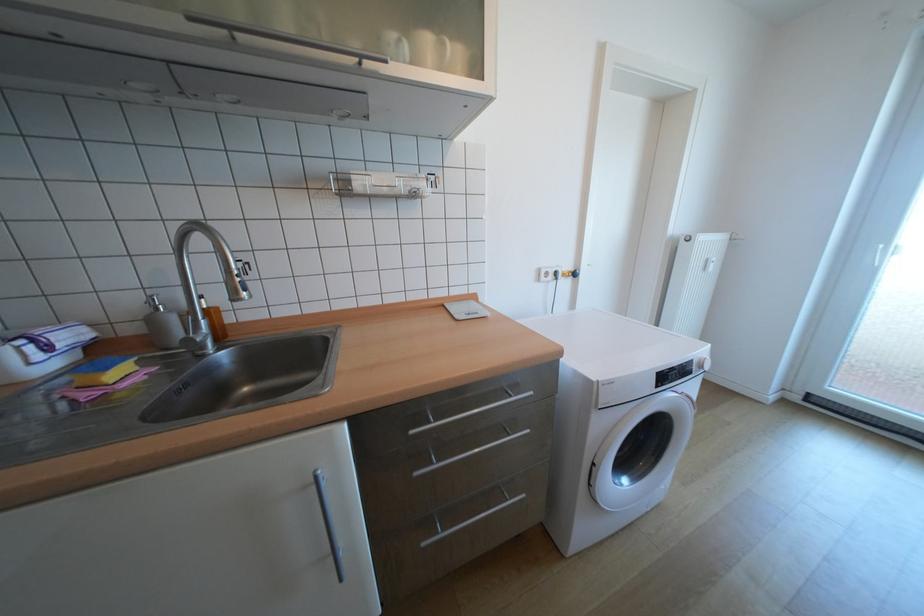
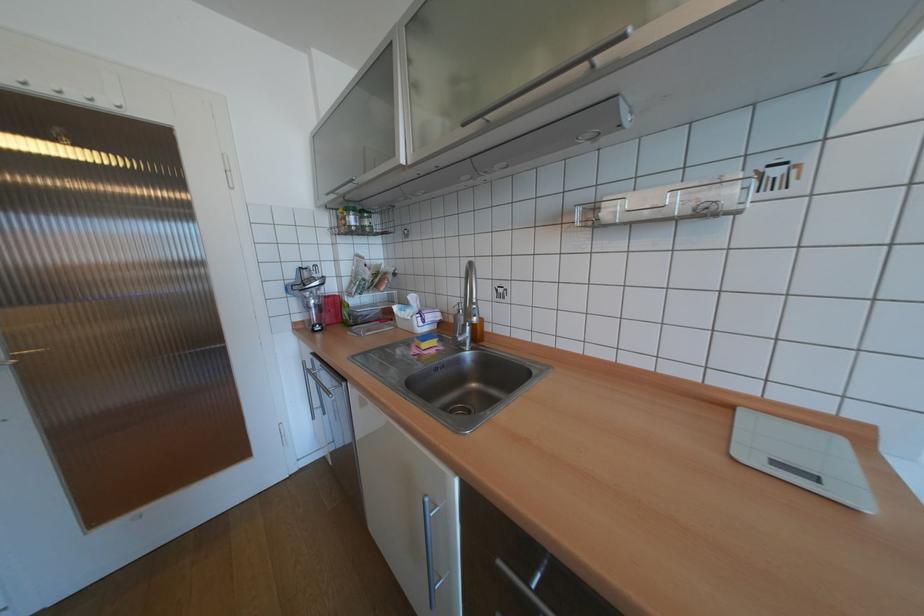
Question: How did the camera likely rotate?

Choices:
 (A) Left
 (B) Right
 (C) Up
 (D) Down

Answer: (A)